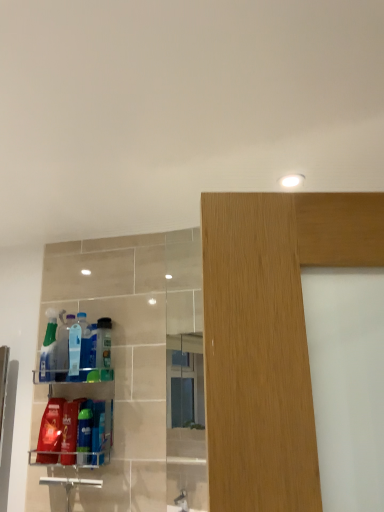
Measure the distance between point (x=72, y=320) and camera.

Point (x=72, y=320) and camera are 5.65 feet apart.

The height and width of the screenshot is (512, 384). In order to click on translucent plastic bottle at left, the 6th cleaning product from the right in this screenshot , I will do `click(63, 346)`.

Image resolution: width=384 pixels, height=512 pixels. What are the coordinates of `translucent plastic bottles at left` in the screenshot? It's located at (78, 422).

How much space does translucent plastic bottle at center, acting as the 1th cleaning product starting from the right, occupy vertically?

10.02 inches.

What do you see at coordinates (104, 349) in the screenshot?
I see `translucent plastic bottle at center, acting as the 1th cleaning product starting from the right` at bounding box center [104, 349].

How much space does translucent plastic spray bottle at left, the 1th cleaning product viewed from the left, occupy horizontally?

3.83 inches.

Where is `translucent plastic bottle at left, the 3th cleaning product when ordered from left to right`? This screenshot has height=512, width=384. translucent plastic bottle at left, the 3th cleaning product when ordered from left to right is located at coordinates (63, 346).

How far apart are matte red plastic bottle at lower left, acting as the second cleaning product starting from the left, and translucent plastic bottles at left?

matte red plastic bottle at lower left, acting as the second cleaning product starting from the left, is 7.95 centimeters from translucent plastic bottles at left.

Choose the correct answer: Is matte red plastic bottle at lower left, acting as the second cleaning product starting from the left, inside translucent plastic bottles at left or outside it?

matte red plastic bottle at lower left, acting as the second cleaning product starting from the left, lies within the bounds of translucent plastic bottles at left.

Which of these two, matte red plastic bottle at lower left, acting as the 7th cleaning product starting from the right, or translucent plastic bottles at left, is smaller?

With smaller size is matte red plastic bottle at lower left, acting as the 7th cleaning product starting from the right.

From the picture: Between matte red plastic bottle at lower left, acting as the second cleaning product starting from the left, and translucent plastic bottles at left, which one has larger width?

With larger width is translucent plastic bottles at left.

Can you tell me how much blue glossy bottle at lower left, marked as the 2th cleaning product in a right-to-left arrangement, and translucent plastic spray bottle at left, the 1th cleaning product viewed from the left, differ in facing direction?

The angle between the facing direction of blue glossy bottle at lower left, marked as the 2th cleaning product in a right-to-left arrangement, and the facing direction of translucent plastic spray bottle at left, the 1th cleaning product viewed from the left, is 0.00371 degrees.

Is blue glossy bottle at lower left, which is the 7th cleaning product from left to right, spatially inside translucent plastic spray bottle at left, the 1th cleaning product viewed from the left, or outside of it?

blue glossy bottle at lower left, which is the 7th cleaning product from left to right, is not enclosed by translucent plastic spray bottle at left, the 1th cleaning product viewed from the left.

I want to click on the 5th cleaning product in front of the translucent plastic spray bottle at left, marked as the eighth cleaning product in a right-to-left arrangement, so click(x=98, y=426).

In terms of size, does blue glossy bottle at lower left, marked as the 2th cleaning product in a right-to-left arrangement, appear bigger or smaller than translucent plastic spray bottle at left, marked as the eighth cleaning product in a right-to-left arrangement?

Considering their sizes, blue glossy bottle at lower left, marked as the 2th cleaning product in a right-to-left arrangement, takes up less space than translucent plastic spray bottle at left, marked as the eighth cleaning product in a right-to-left arrangement.

From the image's perspective, which object appears higher, translucent plastic spray bottle at left, marked as the eighth cleaning product in a right-to-left arrangement, or translucent plastic spray bottle at left, arranged as the 4th cleaning product when viewed from the right?

translucent plastic spray bottle at left, marked as the eighth cleaning product in a right-to-left arrangement.

Is point (41, 356) positioned behind point (84, 368)?

Yes, it is.

Which of these two, translucent plastic spray bottle at left, the 1th cleaning product viewed from the left, or translucent plastic spray bottle at left, arranged as the 4th cleaning product when viewed from the right, stands shorter?

Standing shorter between the two is translucent plastic spray bottle at left, arranged as the 4th cleaning product when viewed from the right.

Looking at this image, is translucent plastic spray bottle at left, the 1th cleaning product viewed from the left, wider or thinner than translucent plastic spray bottle at left, arranged as the 4th cleaning product when viewed from the right?

Clearly, translucent plastic spray bottle at left, the 1th cleaning product viewed from the left, has more width compared to translucent plastic spray bottle at left, arranged as the 4th cleaning product when viewed from the right.

Which of these two, translucent plastic bottle at left, the 3th cleaning product when ordered from left to right, or blue glossy bottle at lower left, which appears as the 3th cleaning product when viewed from the right, is bigger?

Bigger between the two is translucent plastic bottle at left, the 3th cleaning product when ordered from left to right.

How many degrees apart are the facing directions of translucent plastic bottle at left, the 3th cleaning product when ordered from left to right, and blue glossy bottle at lower left, which appears as the 3th cleaning product when viewed from the right?

The angle between the facing direction of translucent plastic bottle at left, the 3th cleaning product when ordered from left to right, and the facing direction of blue glossy bottle at lower left, which appears as the 3th cleaning product when viewed from the right, is 0.00331 degrees.

Locate an element on the screen. The width and height of the screenshot is (384, 512). the 3rd cleaning product counting from the left side of the blue glossy bottle at lower left, which appears as the 3th cleaning product when viewed from the right is located at coordinates (63, 346).

How far apart are translucent plastic bottle at left, the 3th cleaning product when ordered from left to right, and blue glossy bottle at lower left, which appears as the 3th cleaning product when viewed from the right?

8.86 inches.

Who is taller, translucent plastic bottle at left, the 6th cleaning product from the right, or translucent plastic bottle at center, acting as the 1th cleaning product starting from the right?

translucent plastic bottle at left, the 6th cleaning product from the right, is taller.

Is translucent plastic bottle at left, the 3th cleaning product when ordered from left to right, in contact with translucent plastic bottle at center, the 8th cleaning product when ordered from left to right?

translucent plastic bottle at left, the 3th cleaning product when ordered from left to right, and translucent plastic bottle at center, the 8th cleaning product when ordered from left to right, are clearly separated.

Considering the sizes of translucent plastic bottle at left, the 6th cleaning product from the right, and translucent plastic bottle at center, the 8th cleaning product when ordered from left to right, in the image, is translucent plastic bottle at left, the 6th cleaning product from the right, wider or thinner than translucent plastic bottle at center, the 8th cleaning product when ordered from left to right,?

Clearly, translucent plastic bottle at left, the 6th cleaning product from the right, has more width compared to translucent plastic bottle at center, the 8th cleaning product when ordered from left to right.

Considering the sizes of objects translucent plastic bottle at left, the 3th cleaning product when ordered from left to right, and translucent plastic bottle at center, acting as the 1th cleaning product starting from the right, in the image provided, who is smaller, translucent plastic bottle at left, the 3th cleaning product when ordered from left to right, or translucent plastic bottle at center, acting as the 1th cleaning product starting from the right,?

With smaller size is translucent plastic bottle at center, acting as the 1th cleaning product starting from the right.

Considering the relative positions of matte red plastic bottle at lower left, acting as the second cleaning product starting from the left, and translucent plastic bottle at center, acting as the 1th cleaning product starting from the right, in the image provided, is matte red plastic bottle at lower left, acting as the second cleaning product starting from the left, in front of translucent plastic bottle at center, acting as the 1th cleaning product starting from the right,?

Yes, matte red plastic bottle at lower left, acting as the second cleaning product starting from the left, is in front of translucent plastic bottle at center, acting as the 1th cleaning product starting from the right.

Consider the image. How distant is matte red plastic bottle at lower left, acting as the second cleaning product starting from the left, from translucent plastic bottle at center, the 8th cleaning product when ordered from left to right?

They are 26.95 centimeters apart.

Considering the sizes of objects matte red plastic bottle at lower left, acting as the 7th cleaning product starting from the right, and translucent plastic bottle at center, acting as the 1th cleaning product starting from the right, in the image provided, who is smaller, matte red plastic bottle at lower left, acting as the 7th cleaning product starting from the right, or translucent plastic bottle at center, acting as the 1th cleaning product starting from the right,?

translucent plastic bottle at center, acting as the 1th cleaning product starting from the right, is smaller.

From the image's perspective, who appears lower, matte red plastic bottle at lower left, acting as the 7th cleaning product starting from the right, or translucent plastic bottle at center, acting as the 1th cleaning product starting from the right?

matte red plastic bottle at lower left, acting as the 7th cleaning product starting from the right.

Are translucent plastic spray bottle at left, the 1th cleaning product viewed from the left, and translucent plastic bottles at left, marked as the 4th cleaning product in a left-to-right arrangement, beside each other?

There is a gap between translucent plastic spray bottle at left, the 1th cleaning product viewed from the left, and translucent plastic bottles at left, marked as the 4th cleaning product in a left-to-right arrangement.

Which object is thinner, translucent plastic spray bottle at left, the 1th cleaning product viewed from the left, or translucent plastic bottles at left, arranged as the 5th cleaning product when viewed from the right?

translucent plastic bottles at left, arranged as the 5th cleaning product when viewed from the right.

In the scene shown: Which is in front, translucent plastic spray bottle at left, marked as the eighth cleaning product in a right-to-left arrangement, or translucent plastic bottles at left, marked as the 4th cleaning product in a left-to-right arrangement?

Positioned in front is translucent plastic bottles at left, marked as the 4th cleaning product in a left-to-right arrangement.

From their relative heights in the image, would you say translucent plastic spray bottle at left, marked as the eighth cleaning product in a right-to-left arrangement, is taller or shorter than translucent plastic bottles at left, arranged as the 5th cleaning product when viewed from the right?

translucent plastic spray bottle at left, marked as the eighth cleaning product in a right-to-left arrangement, is taller than translucent plastic bottles at left, arranged as the 5th cleaning product when viewed from the right.

This screenshot has height=512, width=384. What are the coordinates of `cleaning product that is the 1st one below the translucent plastic bottles at left (from a real-world perspective)` in the screenshot? It's located at (51, 426).

I want to click on cleaning product that is the 4th object located above the blue glossy bottle at lower left, which is the 7th cleaning product from left to right (from the image's perspective), so click(x=49, y=348).

When comparing their distances from matte red plastic bottle at lower left, acting as the second cleaning product starting from the left, does blue glossy bottle at lower left, the 6th cleaning product in the left-to-right sequence, or translucent plastic spray bottle at left, marked as the eighth cleaning product in a right-to-left arrangement, seem closer?

blue glossy bottle at lower left, the 6th cleaning product in the left-to-right sequence, is closer to matte red plastic bottle at lower left, acting as the second cleaning product starting from the left.

When comparing their distances from translucent plastic bottle at center, acting as the 1th cleaning product starting from the right, does translucent plastic bottle at left, the 3th cleaning product when ordered from left to right, or translucent plastic spray bottle at left, acting as the 5th cleaning product starting from the left, seem further?

translucent plastic bottle at left, the 3th cleaning product when ordered from left to right, lies further to translucent plastic bottle at center, acting as the 1th cleaning product starting from the right, than the other object.

Estimate the real-world distances between objects in this image. Which object is closer to translucent plastic bottles at left, arranged as the 5th cleaning product when viewed from the right, matte red plastic bottle at lower left, acting as the second cleaning product starting from the left, or translucent plastic spray bottle at left, the 1th cleaning product viewed from the left?

translucent plastic spray bottle at left, the 1th cleaning product viewed from the left, lies closer to translucent plastic bottles at left, arranged as the 5th cleaning product when viewed from the right, than the other object.

Looking at the image, which one is located further to translucent plastic bottle at center, acting as the 1th cleaning product starting from the right, translucent plastic bottle at left, the 3th cleaning product when ordered from left to right, or blue glossy bottle at lower left, which is the 7th cleaning product from left to right?

Among the two, blue glossy bottle at lower left, which is the 7th cleaning product from left to right, is located further to translucent plastic bottle at center, acting as the 1th cleaning product starting from the right.

Which object lies further to the anchor point translucent plastic bottle at left, the 3th cleaning product when ordered from left to right, translucent plastic bottles at left or blue glossy bottle at lower left, which appears as the 3th cleaning product when viewed from the right?

Among the two, blue glossy bottle at lower left, which appears as the 3th cleaning product when viewed from the right, is located further to translucent plastic bottle at left, the 3th cleaning product when ordered from left to right.

When comparing their distances from translucent plastic spray bottle at left, acting as the 5th cleaning product starting from the left, does translucent plastic bottles at left, arranged as the 5th cleaning product when viewed from the right, or matte red plastic bottle at lower left, acting as the second cleaning product starting from the left, seem further?

matte red plastic bottle at lower left, acting as the second cleaning product starting from the left.

Estimate the real-world distances between objects in this image. Which object is closer to translucent plastic bottles at left, marked as the 4th cleaning product in a left-to-right arrangement, blue glossy bottle at lower left, the 6th cleaning product in the left-to-right sequence, or translucent plastic spray bottle at left, the 1th cleaning product viewed from the left?

The object closer to translucent plastic bottles at left, marked as the 4th cleaning product in a left-to-right arrangement, is translucent plastic spray bottle at left, the 1th cleaning product viewed from the left.

Which object lies nearer to the anchor point translucent plastic bottles at left, translucent plastic bottle at center, acting as the 1th cleaning product starting from the right, or translucent plastic bottle at left, the 6th cleaning product from the right?

translucent plastic bottle at center, acting as the 1th cleaning product starting from the right, is closer to translucent plastic bottles at left.

I want to click on shelf between matte red plastic bottle at lower left, acting as the 7th cleaning product starting from the right, and blue glossy bottle at lower left, which appears as the 3th cleaning product when viewed from the right, from left to right, so point(78,422).

At what (x,y) coordinates should I click in order to perform the action: click on shelf between translucent plastic spray bottle at left, arranged as the 4th cleaning product when viewed from the right, and matte red plastic bottle at lower left, acting as the 7th cleaning product starting from the right, vertically. Please return your answer as a coordinate pair (x, y). This screenshot has width=384, height=512. Looking at the image, I should click on 78,422.

You are a GUI agent. You are given a task and a screenshot of the screen. Output one action in this format:
    pyautogui.click(x=<x>, y=<y>)
    Task: Click on the cleaning product that lies between translucent plastic bottle at center, acting as the 1th cleaning product starting from the right, and blue glossy bottle at lower left, which is the 7th cleaning product from left to right, from top to bottom
    This screenshot has width=384, height=512.
    Given the screenshot: What is the action you would take?
    pyautogui.click(x=88, y=350)

I want to click on shelf between translucent plastic bottles at left, marked as the 4th cleaning product in a left-to-right arrangement, and matte red plastic bottle at lower left, acting as the second cleaning product starting from the left, vertically, so click(78, 422).